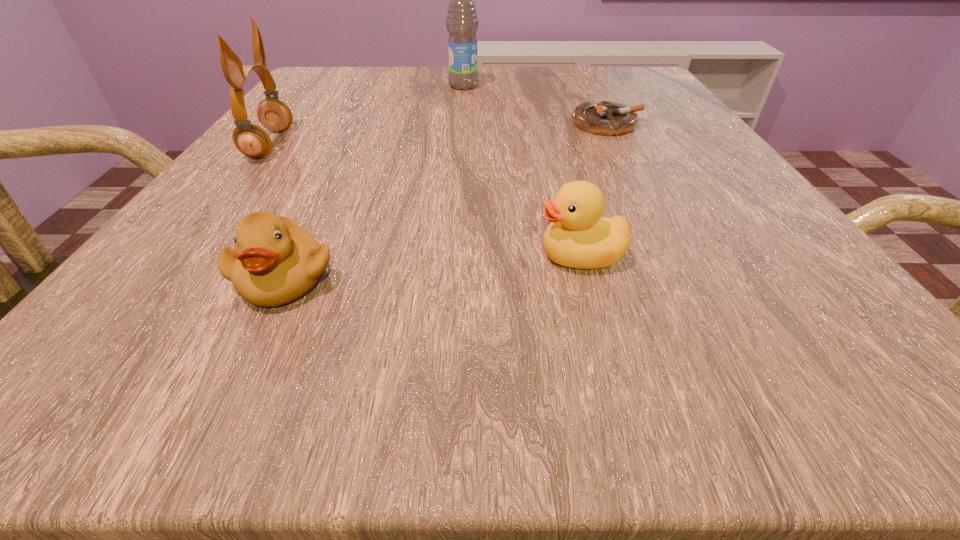
The image size is (960, 540). Find the location of `water bottle`. water bottle is located at coordinates (462, 23).

Identify the location of the third object from right to left. (462, 23).

Where is `the leftmost object`? This screenshot has width=960, height=540. the leftmost object is located at coordinates (251, 140).

Locate an element on the screen. duck is located at coordinates (577, 237).

Find the location of a particular element. The image size is (960, 540). the second object from left to right is located at coordinates (275, 261).

This screenshot has width=960, height=540. I want to click on ashtray, so click(606, 118).

Where is `vacant position located on the front of the third object from right to left`? Image resolution: width=960 pixels, height=540 pixels. vacant position located on the front of the third object from right to left is located at coordinates (462, 117).

Locate an element on the screen. blank space located 0.340m on the front-facing side of the earphone is located at coordinates (492, 144).

This screenshot has height=540, width=960. In order to click on vacant space located 0.300m at the beak of the duck in this screenshot , I will do `click(279, 255)`.

The height and width of the screenshot is (540, 960). In order to click on free space located 0.280m at the beak of the duck in this screenshot , I will do `click(296, 255)`.